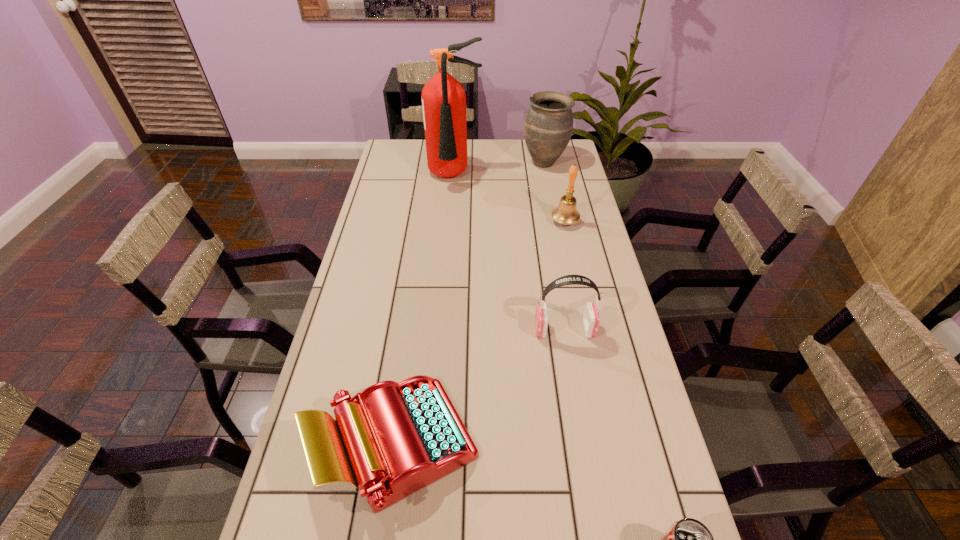
This screenshot has height=540, width=960. I want to click on the tallest object, so click(x=443, y=98).

Where is `urn`? urn is located at coordinates (548, 125).

This screenshot has height=540, width=960. In order to click on the third farthest object in this screenshot , I will do `click(566, 213)`.

The image size is (960, 540). Identify the location of the fourth farthest object. (591, 319).

Identify the location of the third shortest object. This screenshot has width=960, height=540. (591, 319).

Find the location of a particular element. The image size is (960, 540). typewriter is located at coordinates (396, 438).

Locate an element on the screen. Image resolution: width=960 pixels, height=540 pixels. the fifth tallest object is located at coordinates (396, 438).

The width and height of the screenshot is (960, 540). What are the coordinates of `blank area located at the nozzle of the fire extinguisher` in the screenshot? It's located at (450, 235).

This screenshot has height=540, width=960. In order to click on free location located 0.380m on the left of the urn in this screenshot , I will do `click(431, 163)`.

The width and height of the screenshot is (960, 540). Identify the location of blank space located on the left of the bell. point(467,221).